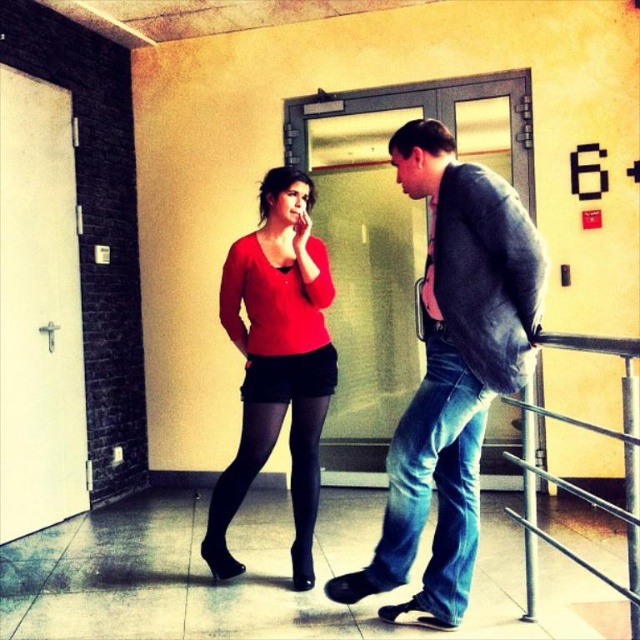
Question: Is denim jeans at center smaller than jeans at right?

Choices:
 (A) no
 (B) yes

Answer: (A)

Question: Which of the following is the closest to the observer?

Choices:
 (A) (628, 454)
 (B) (387, 609)

Answer: (A)

Question: Among these objects, which one is farthest from the camera?

Choices:
 (A) metallic silver railing at lower right
 (B) denim jeans at center
 (C) jeans at right

Answer: (C)

Question: Does denim jeans at center appear over metallic silver railing at lower right?

Choices:
 (A) yes
 (B) no

Answer: (A)

Question: Based on their relative distances, which object is nearer to the matte red sweater at center?

Choices:
 (A) denim jeans at center
 (B) metallic silver railing at lower right
 (C) jeans at right

Answer: (A)

Question: Is denim jeans at center to the right of matte red sweater at center from the viewer's perspective?

Choices:
 (A) no
 (B) yes

Answer: (B)